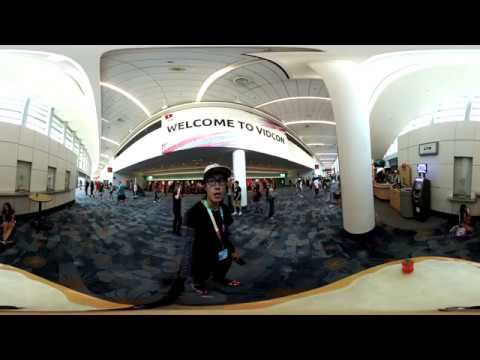
What are the coordinates of `carpet` in the screenshot? It's located at [134, 225].